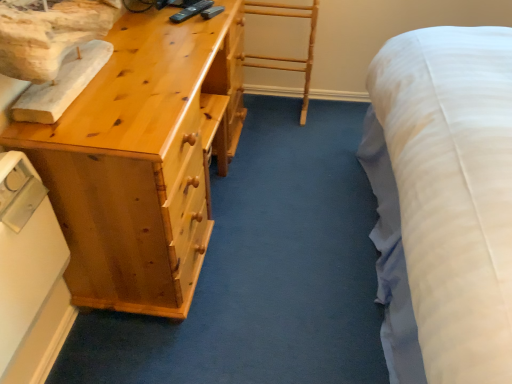
The height and width of the screenshot is (384, 512). In order to click on light wood chest of drawers at left in this screenshot , I will do `click(142, 160)`.

Measure the distance between point (231, 72) and camera.

They are 1.86 meters apart.

Describe the element at coordinates (142, 160) in the screenshot. I see `light wood chest of drawers at left` at that location.

Locate an element on the screen. This screenshot has width=512, height=384. white plastic switch at lower left is located at coordinates (30, 275).

Image resolution: width=512 pixels, height=384 pixels. What do you see at coordinates (30, 275) in the screenshot? I see `white plastic switch at lower left` at bounding box center [30, 275].

You are a GUI agent. You are given a task and a screenshot of the screen. Output one action in this format:
    pyautogui.click(x=<x>, y=<y>)
    Task: Click on the light wood chest of drawers at left
    
    Given the screenshot: What is the action you would take?
    pyautogui.click(x=142, y=160)

Which is more to the left, light wood chest of drawers at left or white plastic switch at lower left?

From the viewer's perspective, white plastic switch at lower left appears more on the left side.

Between light wood chest of drawers at left and white plastic switch at lower left, which one is positioned behind?

light wood chest of drawers at left is further away from the camera.

Is point (77, 145) in front of point (39, 214)?

Yes, point (77, 145) is closer to viewer.

From the image's perspective, is light wood chest of drawers at left above or below white plastic switch at lower left?

light wood chest of drawers at left is situated higher than white plastic switch at lower left in the image.

From a real-world perspective, is light wood chest of drawers at left beneath white plastic switch at lower left?

Yes, from a real-world perspective, light wood chest of drawers at left is below white plastic switch at lower left.

Which object is wider, light wood chest of drawers at left or white plastic switch at lower left?

With larger width is light wood chest of drawers at left.

Considering the relative sizes of light wood chest of drawers at left and white plastic switch at lower left in the image provided, is light wood chest of drawers at left shorter than white plastic switch at lower left?

In fact, light wood chest of drawers at left may be taller than white plastic switch at lower left.

In terms of size, does light wood chest of drawers at left appear bigger or smaller than white plastic switch at lower left?

Clearly, light wood chest of drawers at left is larger in size than white plastic switch at lower left.

In the scene shown: Would you say light wood chest of drawers at left is outside white plastic switch at lower left?

Indeed, light wood chest of drawers at left is completely outside white plastic switch at lower left.

Is light wood chest of drawers at left directly adjacent to white plastic switch at lower left?

No, light wood chest of drawers at left is not in contact with white plastic switch at lower left.

Is light wood chest of drawers at left facing away from white plastic switch at lower left?

No, light wood chest of drawers at left's orientation is not away from white plastic switch at lower left.

How many degrees apart are the facing directions of light wood chest of drawers at left and white plastic switch at lower left?

The angular difference between light wood chest of drawers at left and white plastic switch at lower left is 2.94 degrees.

Where is `appliance on the left side of light wood chest of drawers at left`? Image resolution: width=512 pixels, height=384 pixels. appliance on the left side of light wood chest of drawers at left is located at coordinates (30, 275).

Which is more to the right, white plastic switch at lower left or light wood chest of drawers at left?

light wood chest of drawers at left.

Based on the photo, does white plastic switch at lower left lie behind light wood chest of drawers at left?

No, white plastic switch at lower left is closer to the viewer.

Is point (25, 268) less distant than point (226, 120)?

Yes.

From the image's perspective, relative to light wood chest of drawers at left, is white plastic switch at lower left above or below?

From the image's perspective, white plastic switch at lower left appears below light wood chest of drawers at left.

From a real-world perspective, which object stands above the other?

From a 3D spatial view, white plastic switch at lower left is above.

Between white plastic switch at lower left and light wood chest of drawers at left, which one has smaller width?

white plastic switch at lower left.

Considering the sizes of objects white plastic switch at lower left and light wood chest of drawers at left in the image provided, who is shorter, white plastic switch at lower left or light wood chest of drawers at left?

With less height is white plastic switch at lower left.

Based on their sizes in the image, would you say white plastic switch at lower left is bigger or smaller than light wood chest of drawers at left?

Clearly, white plastic switch at lower left is smaller in size than light wood chest of drawers at left.

Choose the correct answer: Is white plastic switch at lower left inside light wood chest of drawers at left or outside it?

white plastic switch at lower left is outside light wood chest of drawers at left.

Is white plastic switch at lower left in contact with light wood chest of drawers at left?

white plastic switch at lower left is not next to light wood chest of drawers at left, and they're not touching.

Does white plastic switch at lower left turn towards light wood chest of drawers at left?

No, white plastic switch at lower left is not turned towards light wood chest of drawers at left.

Can you tell me how much white plastic switch at lower left and light wood chest of drawers at left differ in facing direction?

There is a 2.94-degree angle between the facing directions of white plastic switch at lower left and light wood chest of drawers at left.

How much distance is there between white plastic switch at lower left and light wood chest of drawers at left?

white plastic switch at lower left and light wood chest of drawers at left are 35.19 centimeters apart from each other.

Locate an element on the screen. appliance on the left side of light wood chest of drawers at left is located at coordinates tap(30, 275).

At what (x,y) coordinates should I click in order to perform the action: click on chest of drawers behind the white plastic switch at lower left. Please return your answer as a coordinate pair (x, y). The width and height of the screenshot is (512, 384). Looking at the image, I should click on (142, 160).

Where is `appliance in front of the light wood chest of drawers at left`? The image size is (512, 384). appliance in front of the light wood chest of drawers at left is located at coordinates (30, 275).